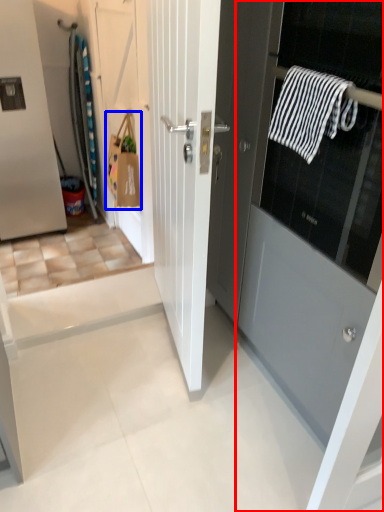
Question: Which object appears closest to the camera in this image, door (highlighted by a red box) or shopping bag (highlighted by a blue box)?

Choices:
 (A) door
 (B) shopping bag

Answer: (A)